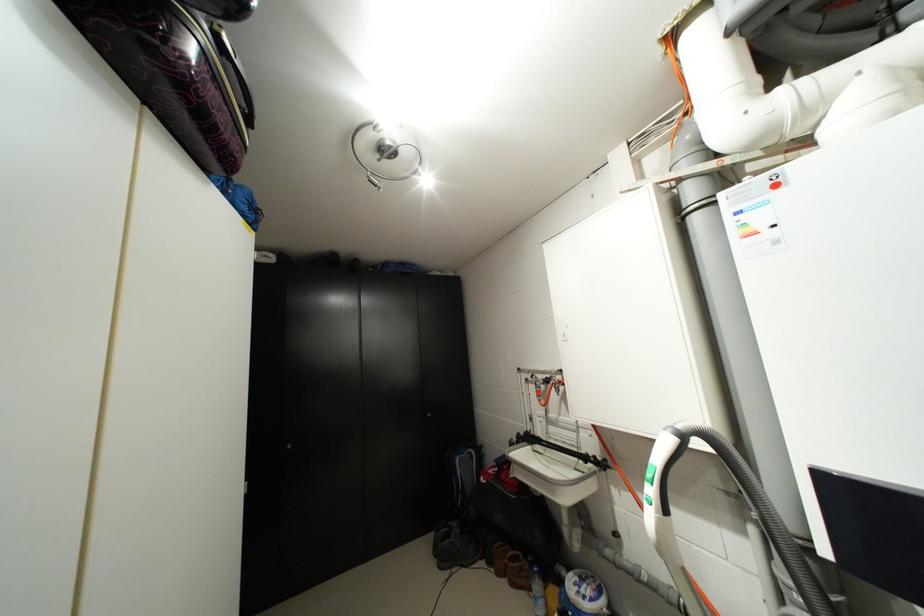
Which object does [517,570] point to?

It refers to a brown shoe.